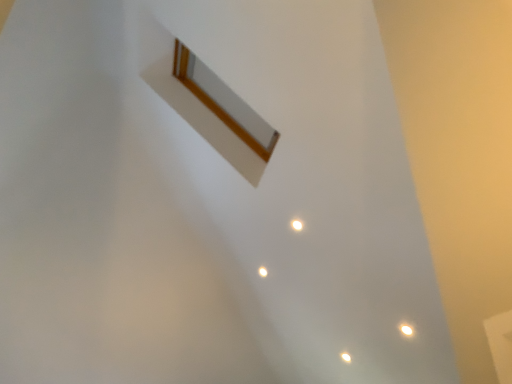
Identify the location of white glossy light at lower right. (346, 357).

Image resolution: width=512 pixels, height=384 pixels. What do you see at coordinates (346, 357) in the screenshot?
I see `white glossy light at lower right` at bounding box center [346, 357].

What is the approximate height of white glossy light at lower right?

white glossy light at lower right is 5.40 inches in height.

Locate an element on the screen. The height and width of the screenshot is (384, 512). white glossy light at lower right is located at coordinates (346, 357).